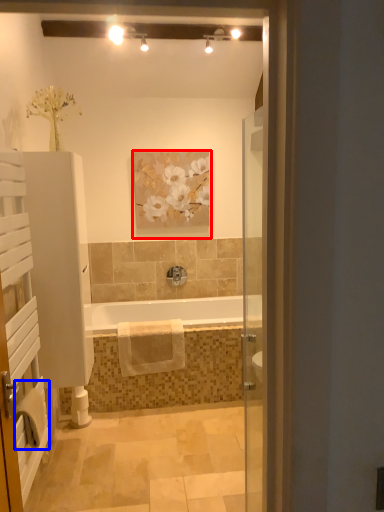
Question: Among these objects, which one is farthest to the camera, picture frame (highlighted by a red box) or bath towel (highlighted by a blue box)?

Choices:
 (A) picture frame
 (B) bath towel

Answer: (A)